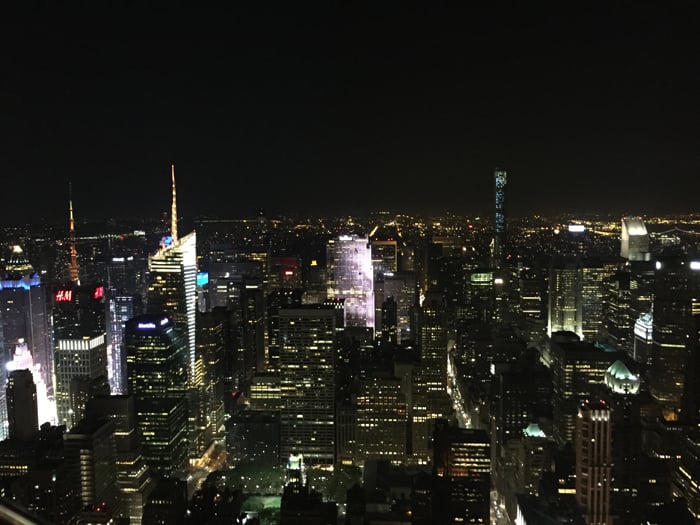
The height and width of the screenshot is (525, 700). In order to click on gold light in this screenshot , I will do `click(608, 223)`.